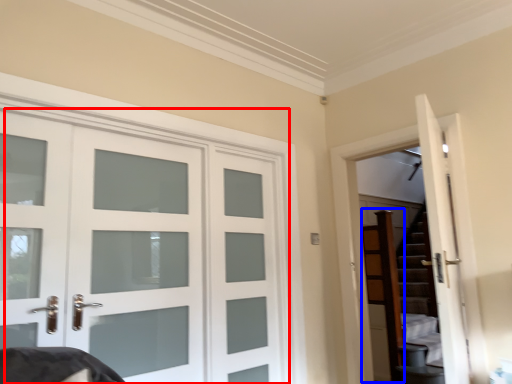
Question: Which of the following is the farthest to the observer, door (highlighted by a red box) or dresser (highlighted by a blue box)?

Choices:
 (A) door
 (B) dresser

Answer: (B)